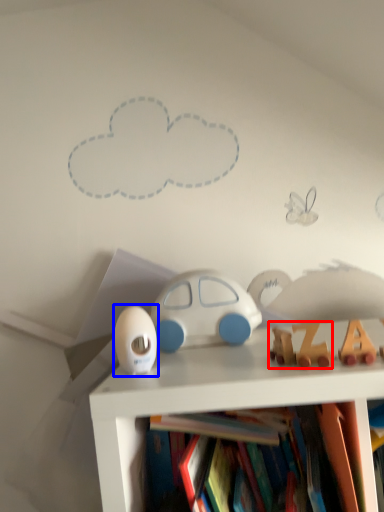
Question: Which point is closer to the camera, toy (highlighted by a red box) or toy (highlighted by a blue box)?

Choices:
 (A) toy
 (B) toy

Answer: (A)